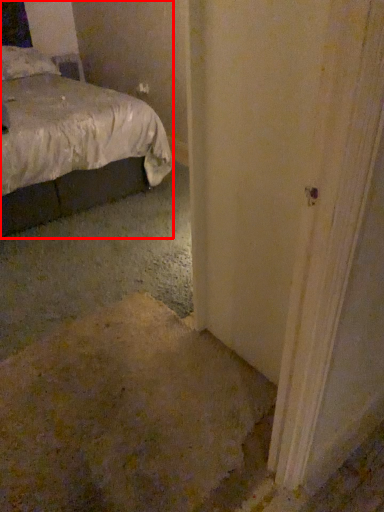
Question: Where is bed (annotated by the red box) located in relation to pillow in the image?

Choices:
 (A) right
 (B) left

Answer: (A)